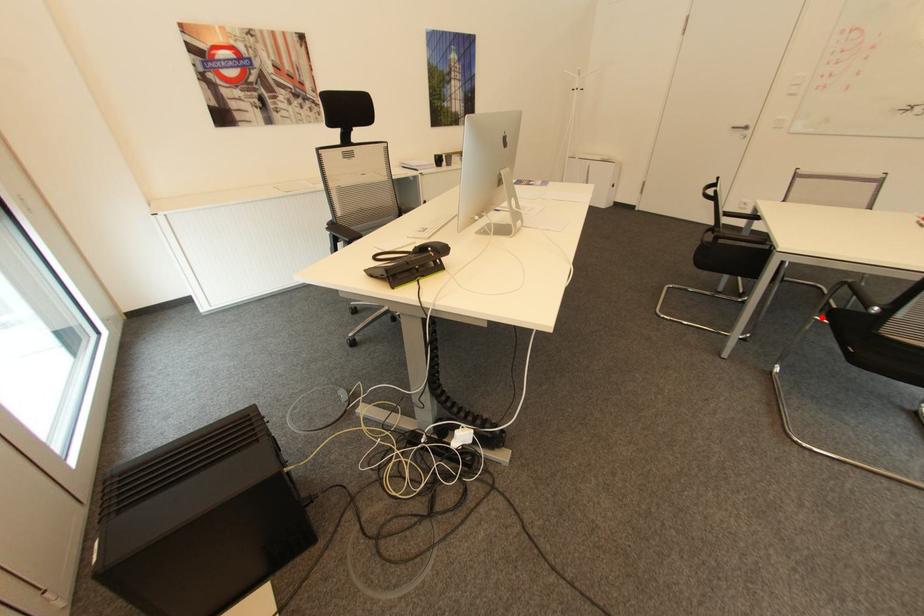
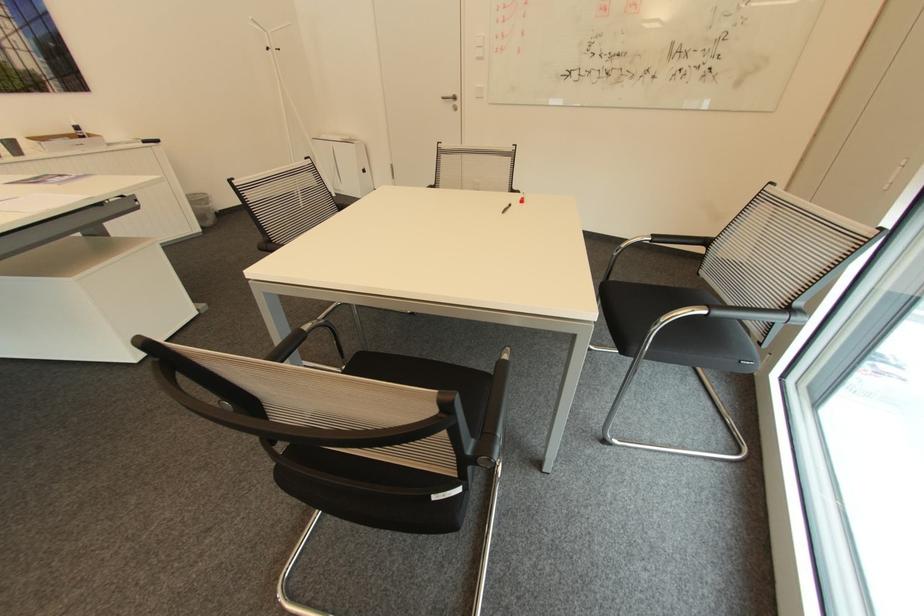
Question: I am providing you with two images of the same scene from different viewpoints. In image1, a red point is highlighted. Considering the same 3D point in image2, which of the following is correct?

Choices:
 (A) It is closer
 (B) It is farther

Answer: (A)